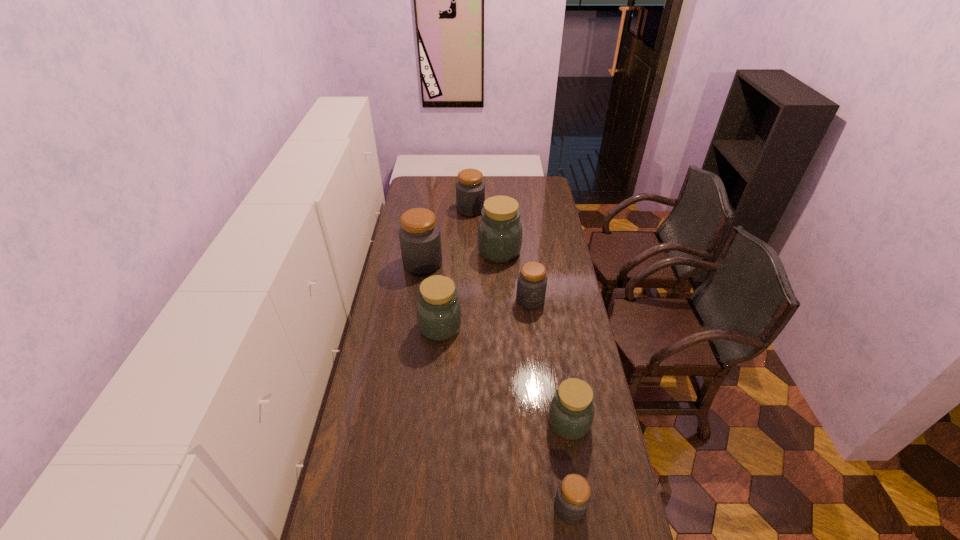
Find the location of `the sixth farthest jar`. the sixth farthest jar is located at coordinates (571, 413).

Find the location of a particular element. Image resolution: width=960 pixels, height=540 pixels. the nearest green jar is located at coordinates (571, 413).

Find the location of a particular element. the shortest jar is located at coordinates (573, 496).

This screenshot has width=960, height=540. Find the location of `the smallest gray jar`. the smallest gray jar is located at coordinates (573, 496).

Identify the location of free spot located 0.190m on the right of the farthest green jar. The image size is (960, 540). (560, 251).

At what (x,y) coordinates should I click in order to perform the action: click on free space located 0.210m on the surface of the biggest gray jar near the warning symbol. Please return your answer as a coordinate pair (x, y). Looking at the image, I should click on 487,263.

Locate an element on the screen. This screenshot has height=540, width=960. vacant position located 0.280m on the surface of the farthest object near the warning symbol is located at coordinates (536, 210).

The height and width of the screenshot is (540, 960). In order to click on vacant space located on the front of the leftmost green jar in this screenshot , I will do `click(431, 427)`.

The width and height of the screenshot is (960, 540). I want to click on vacant area situated 0.210m on the surface of the fourth nearest jar near the warning symbol, so click(537, 349).

Find the location of `blank area located on the left of the rightmost green jar`. blank area located on the left of the rightmost green jar is located at coordinates (530, 423).